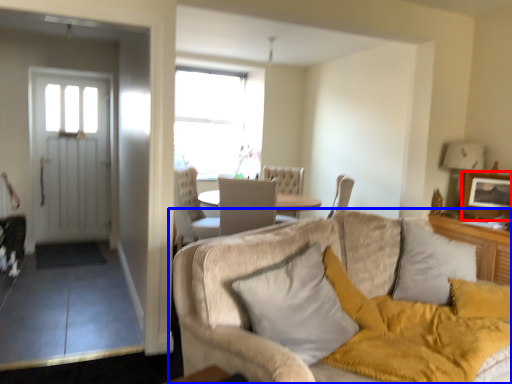
Question: Which object is closer to the camera taking this photo, picture frame (highlighted by a red box) or studio couch (highlighted by a blue box)?

Choices:
 (A) picture frame
 (B) studio couch

Answer: (B)